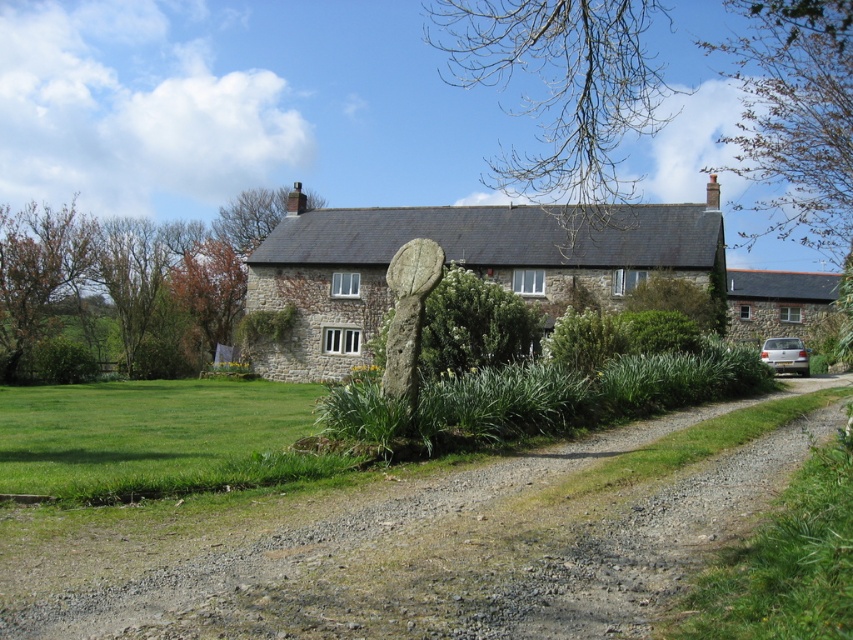
Question: Does gravel at center appear on the right side of silver metallic car at right?

Choices:
 (A) yes
 (B) no

Answer: (B)

Question: Does stone cottage at center appear over light brown stone cottage at right?

Choices:
 (A) no
 (B) yes

Answer: (B)

Question: Based on their relative distances, which object is farther from the gravel at center?

Choices:
 (A) silver metallic car at right
 (B) stone cottage at center
 (C) light brown stone cottage at right

Answer: (C)

Question: Which point appears closest to the camera in this image?

Choices:
 (A) (753, 298)
 (B) (465, 593)
 (C) (775, 358)

Answer: (B)

Question: Does stone cottage at center appear on the right side of silver metallic car at right?

Choices:
 (A) no
 (B) yes

Answer: (A)

Question: Which point is farther from the camera taking this photo?

Choices:
 (A) (318, 253)
 (B) (498, 552)
 (C) (776, 339)
 (D) (799, 288)

Answer: (D)